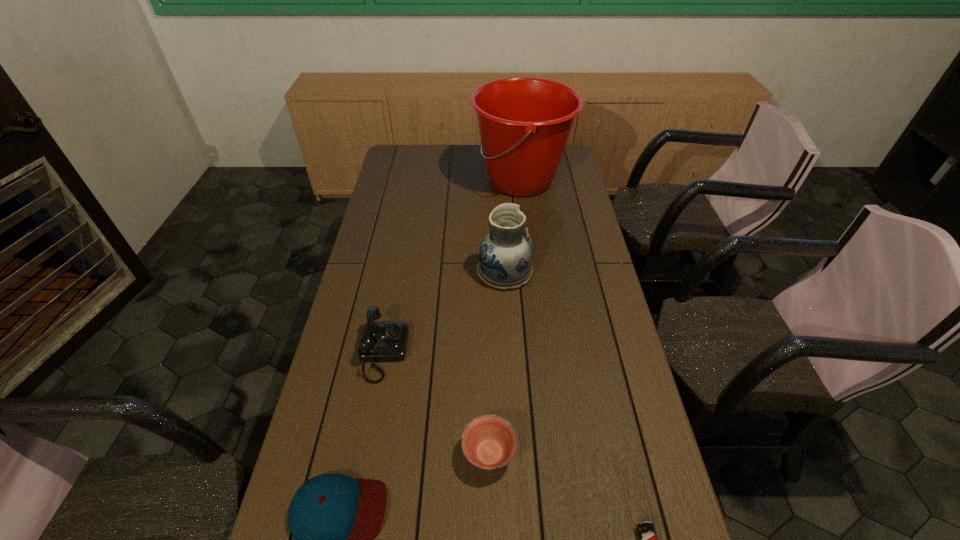
Locate an element on the screen. free space located 0.280m on the back of the pottery is located at coordinates (501, 207).

The height and width of the screenshot is (540, 960). What are the coordinates of `vacant region located on the dial of the telephone` in the screenshot? It's located at (489, 353).

Find the location of a particular element. The height and width of the screenshot is (540, 960). vacant space located 0.280m on the left of the bowl is located at coordinates click(x=348, y=454).

The width and height of the screenshot is (960, 540). Find the location of `object that is at the far edge`. object that is at the far edge is located at coordinates (524, 122).

Where is `object located at the left edge`? This screenshot has width=960, height=540. object located at the left edge is located at coordinates (381, 341).

Find the location of a particular element. Image resolution: width=960 pixels, height=540 pixels. object located in the right edge section of the desktop is located at coordinates (524, 122).

The width and height of the screenshot is (960, 540). I want to click on object located in the far right corner section of the desktop, so click(x=524, y=122).

Locate an element on the screen. The height and width of the screenshot is (540, 960). vacant space at the far edge of the desktop is located at coordinates (439, 146).

I want to click on free space at the left edge of the desktop, so click(x=401, y=177).

Locate an element on the screen. This screenshot has width=960, height=540. free space at the right edge of the desktop is located at coordinates (574, 195).